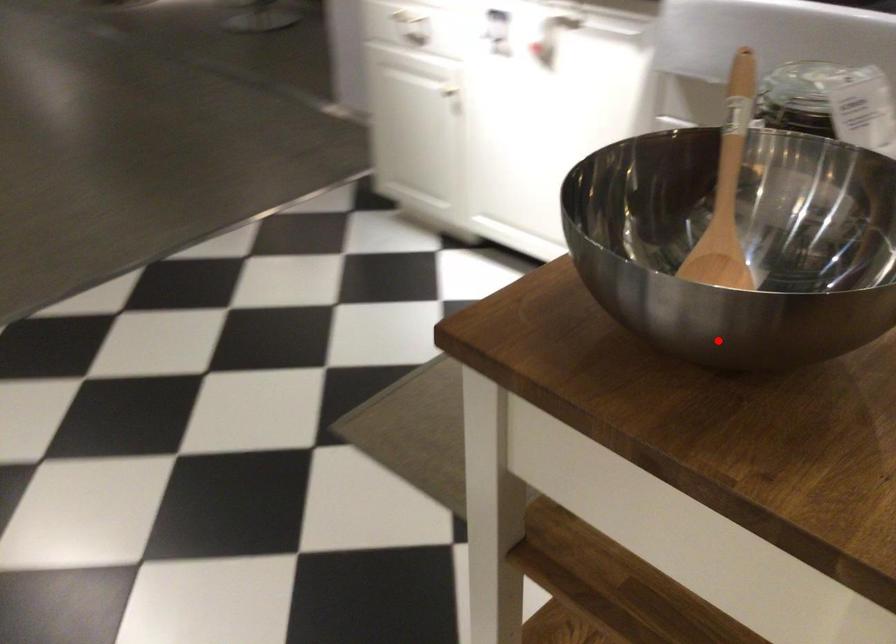
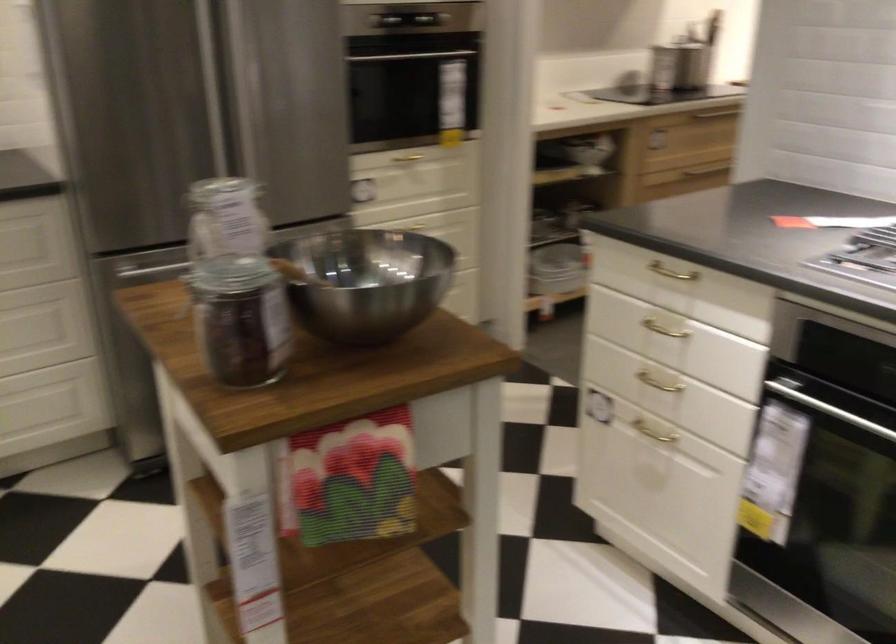
Find the pixel in the second image that matches the highlighted location in the first image.

(366, 281)